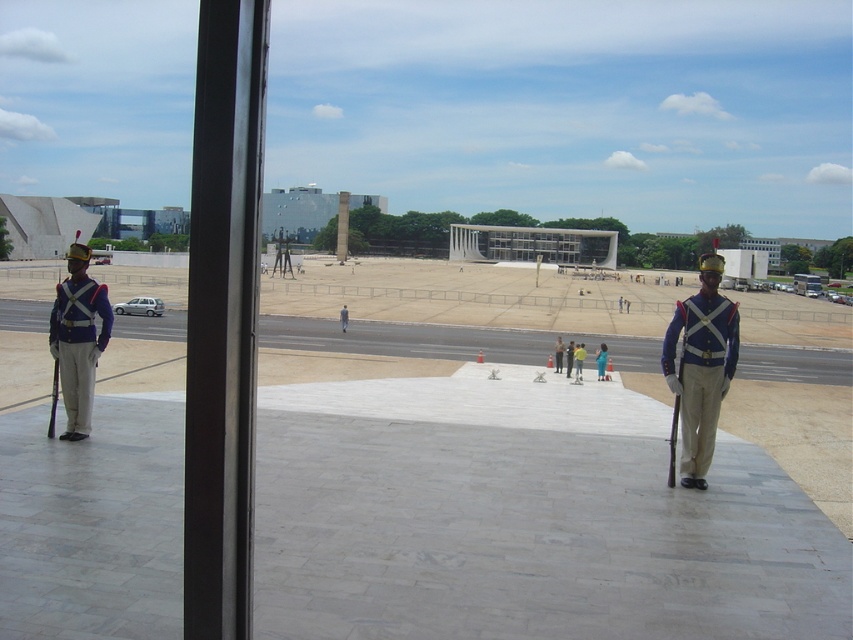
You are an observer looking at the scene through the window. You notice the shiny blue uniform at left and the camouflage uniform at center. Which of these two uniforms appears narrower in the image?

The shiny blue uniform at left appears narrower compared to the camouflage uniform at center as it has a lesser width.

You are an architect designing a new public square. You observe the blue uniformed guard at center and the camouflage uniform at center in the existing plaza. Which of these two guards appears closer to the window through which the scene is viewed?

The blue uniformed guard at center appears closer to the window because objects that are smaller in the image are typically farther away, so the larger camouflage uniform at center is farther back, making the blue one closer to the viewer.